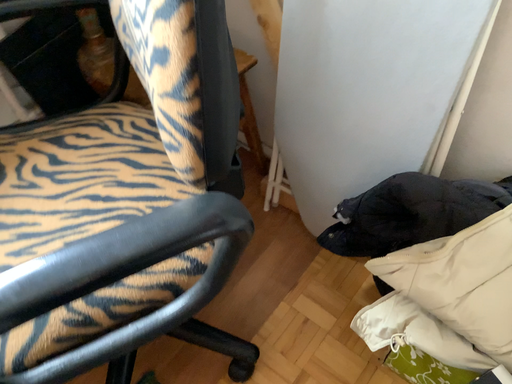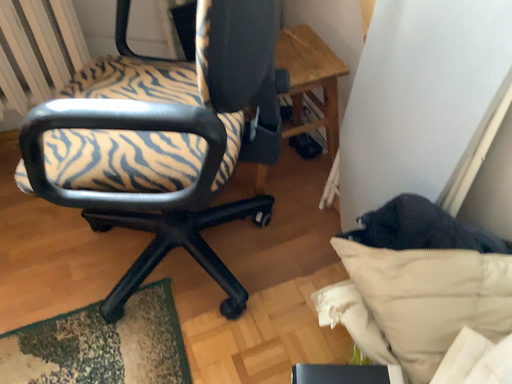
Question: Which way did the camera rotate in the video?

Choices:
 (A) rotated upward
 (B) rotated downward

Answer: (A)